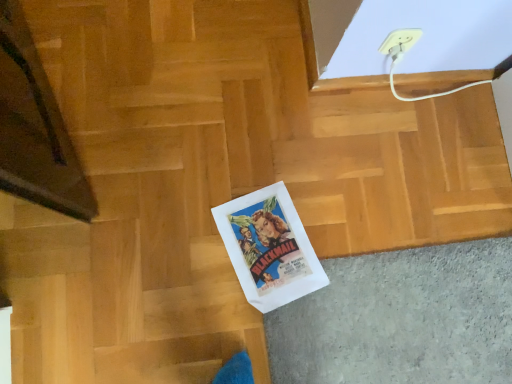
Question: Is point (198, 274) positioned closer to the camera than point (416, 29)?

Choices:
 (A) farther
 (B) closer

Answer: (A)

Question: Looking at their shapes, would you say white paper bag at center is wider or thinner than white plastic electric outlet at upper right?

Choices:
 (A) wide
 (B) thin

Answer: (A)

Question: From their relative heights in the image, would you say white paper bag at center is taller or shorter than white plastic electric outlet at upper right?

Choices:
 (A) tall
 (B) short

Answer: (B)

Question: From the image's perspective, is white plastic electric outlet at upper right located above or below white paper bag at center?

Choices:
 (A) above
 (B) below

Answer: (A)

Question: Considering the positions of white plastic electric outlet at upper right and white paper bag at center in the image, is white plastic electric outlet at upper right wider or thinner than white paper bag at center?

Choices:
 (A) thin
 (B) wide

Answer: (A)

Question: Is white plastic electric outlet at upper right inside the boundaries of white paper bag at center, or outside?

Choices:
 (A) outside
 (B) inside

Answer: (A)

Question: Considering the relative positions of white plastic electric outlet at upper right and white paper bag at center in the image provided, is white plastic electric outlet at upper right to the left or to the right of white paper bag at center?

Choices:
 (A) right
 (B) left

Answer: (A)